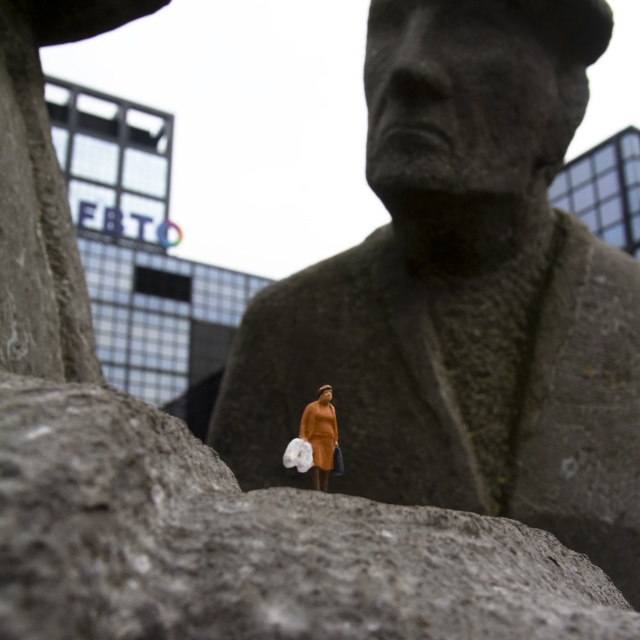
You are an art curator standing in front of the sculpture. You notice the orange fabric dress at center and the matte gray stone bust at center. Which object is closer to you?

The matte gray stone bust at center is closer to you because the orange fabric dress at center is behind it.